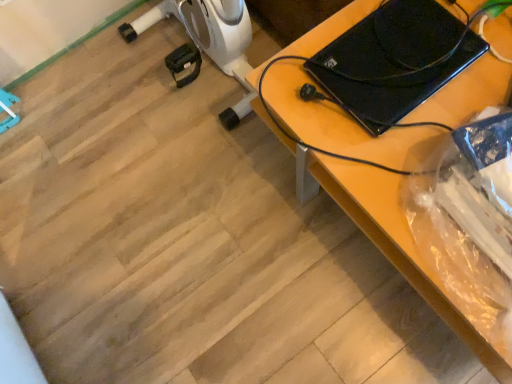
The image size is (512, 384). I want to click on free region under black glossy laptop at upper right (from a real-world perspective), so click(x=372, y=42).